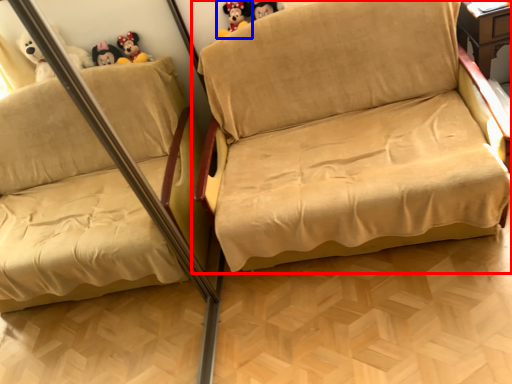
Question: Which of the following is the closest to the observer, studio couch (highlighted by a red box) or toy (highlighted by a blue box)?

Choices:
 (A) studio couch
 (B) toy

Answer: (A)